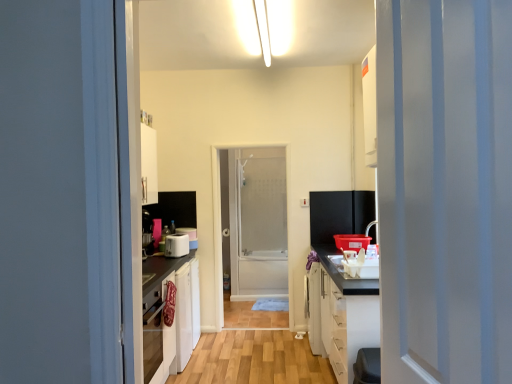
Identify the location of free space above wooden floor at center (from a real-world perspective). The height and width of the screenshot is (384, 512). (251, 351).